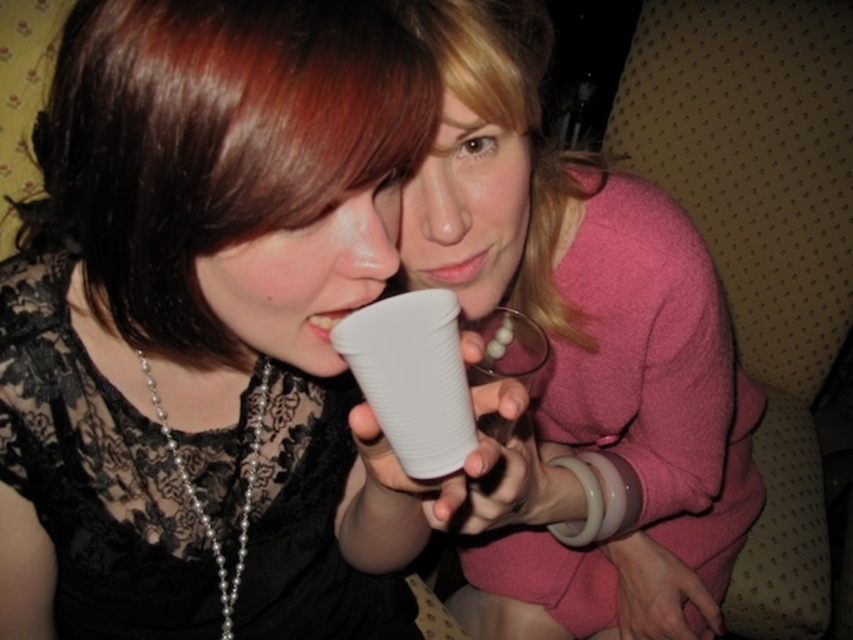
Question: Is pink matte sweater at upper right wider than white plastic cup at center?

Choices:
 (A) yes
 (B) no

Answer: (A)

Question: Estimate the real-world distances between objects in this image. Which object is closer to the blondehair at upper center?

Choices:
 (A) matte white cup at center
 (B) pink matte sweater at upper right

Answer: (B)

Question: Is the position of pink matte sweater at upper right less distant than that of white plastic cup at center?

Choices:
 (A) no
 (B) yes

Answer: (A)

Question: Which of the following is the farthest from the observer?

Choices:
 (A) (532, 92)
 (B) (482, 452)

Answer: (A)

Question: Among these points, which one is nearest to the camera?

Choices:
 (A) (341, 257)
 (B) (467, 609)

Answer: (A)

Question: Can you confirm if pink matte sweater at upper right is bigger than blondehair at upper center?

Choices:
 (A) yes
 (B) no

Answer: (A)